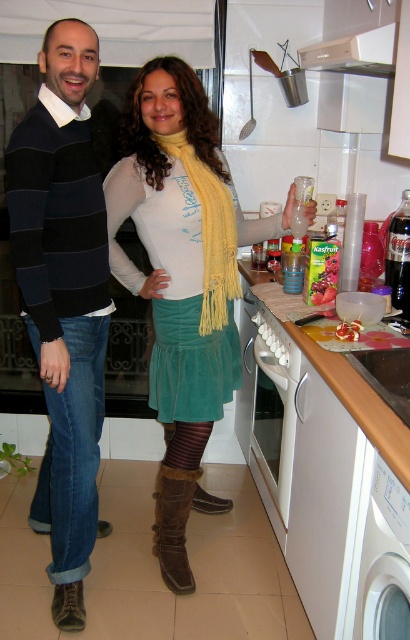
Question: Which point is farther to the camera?

Choices:
 (A) (59, 579)
 (B) (223, 369)
 (C) (378, 506)
 (D) (136, 125)

Answer: (B)

Question: Is striped sweater at left to the right of brown suede boot at lower center from the viewer's perspective?

Choices:
 (A) yes
 (B) no

Answer: (B)

Question: Is velvet green skirt at center smaller than white glossy oven at center?

Choices:
 (A) yes
 (B) no

Answer: (B)

Question: Among these points, which one is nearest to the camera?

Choices:
 (A) coord(172,296)
 (B) coord(373,54)
 (C) coord(170,488)
 (D) coord(63,614)

Answer: (B)

Question: Considering the real-world distances, which object is closest to the white glossy oven at center?

Choices:
 (A) velvet green skirt at center
 (B) suede skirt at center

Answer: (B)

Question: Can you confirm if velvet green skirt at center is bigger than white glossy oven at center?

Choices:
 (A) yes
 (B) no

Answer: (A)